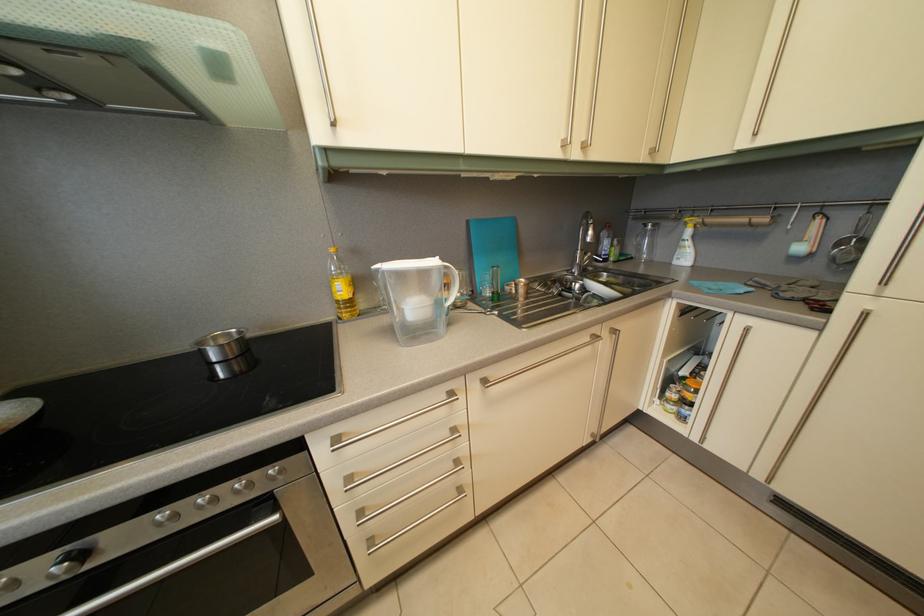
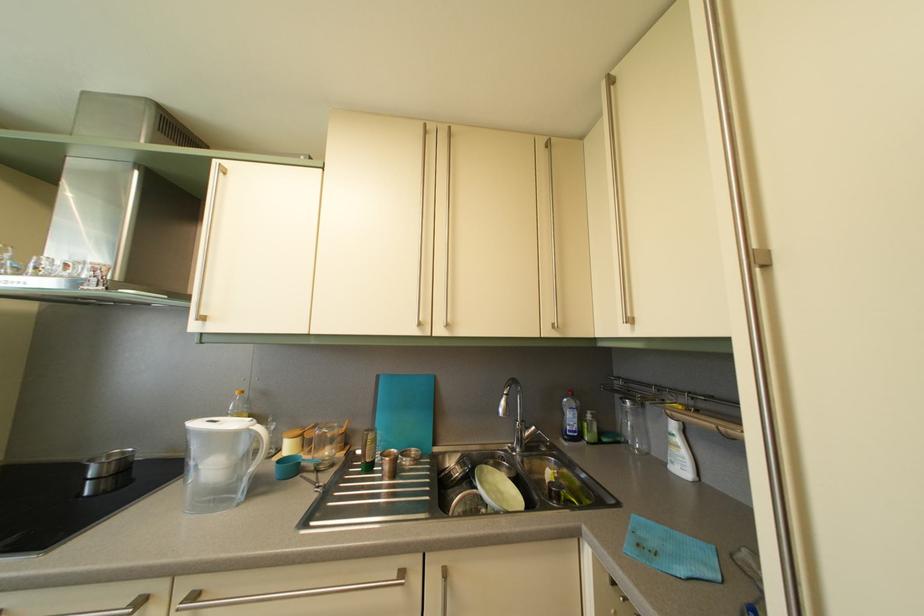
Where in the second image is the point corresponding to point 584,161 from the first image?

(447, 339)